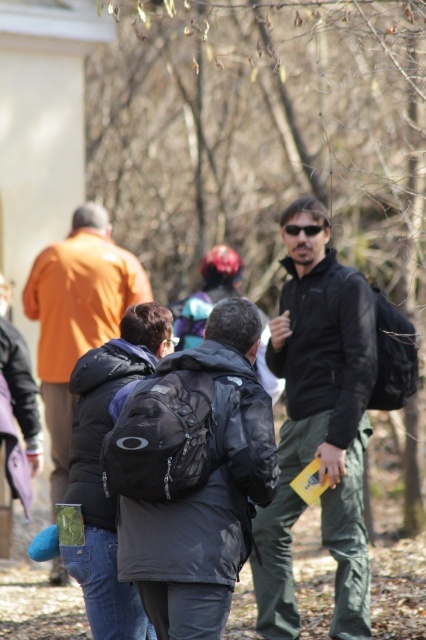
Question: Can you confirm if orange matte jacket at left is wider than black matte sunglasses at center?

Choices:
 (A) yes
 (B) no

Answer: (A)

Question: Which of the following is the farthest from the observer?

Choices:
 (A) (40, 275)
 (B) (298, 621)
 (C) (291, 225)

Answer: (A)

Question: Can you confirm if orange matte jacket at left is positioned to the right of black matte sunglasses at center?

Choices:
 (A) yes
 (B) no

Answer: (B)

Question: Is black matte jacket at center below orange matte jacket at left?

Choices:
 (A) no
 (B) yes

Answer: (B)

Question: Among these objects, which one is nearest to the camera?

Choices:
 (A) black matte sunglasses at center
 (B) black matte jacket at center
 (C) orange matte jacket at left

Answer: (B)

Question: Which point appears closest to the camera in this image?

Choices:
 (A) (294, 230)
 (B) (308, 337)
 (C) (80, 234)

Answer: (B)